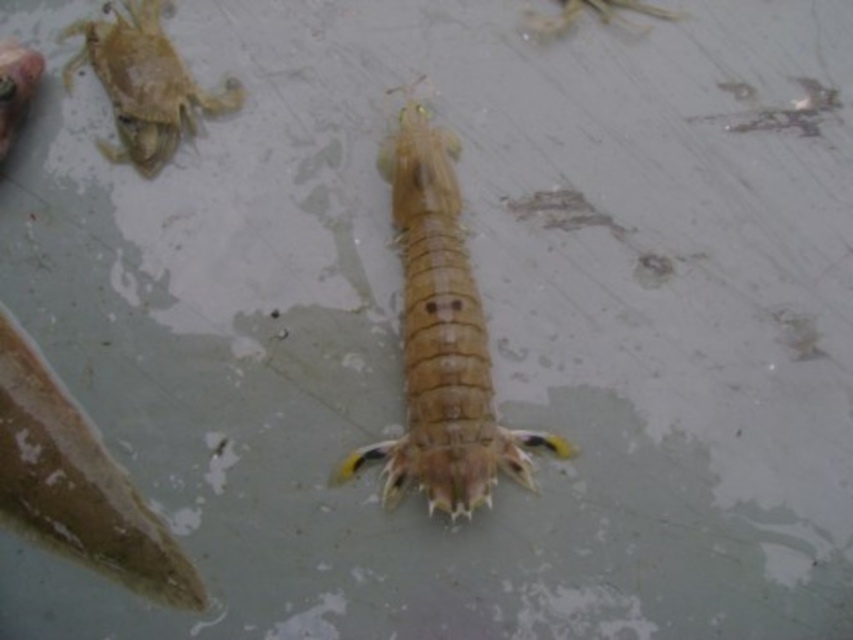
Can you confirm if translucent yellowish crustacean at center is smaller than translucent yellow crab at upper left?

Actually, translucent yellowish crustacean at center might be larger than translucent yellow crab at upper left.

This screenshot has height=640, width=853. In order to click on translucent yellowish crustacean at center in this screenshot , I will do `click(440, 340)`.